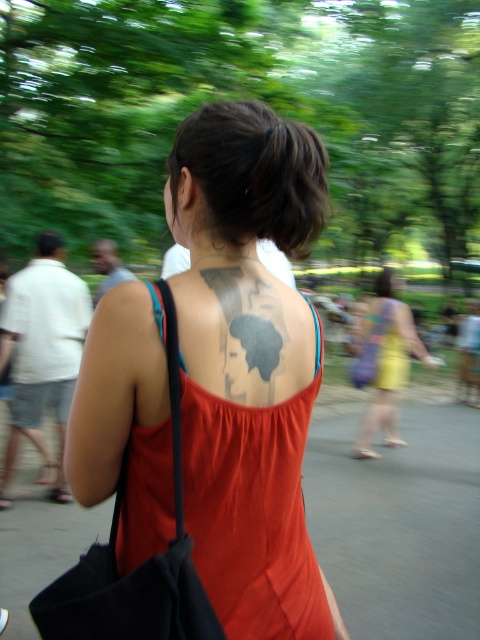
Between point (271, 364) and point (415, 336), which one is positioned in front?

Point (271, 364) is in front.

Which is in front, point (243, 323) or point (372, 336)?

Point (243, 323) is in front.

Image resolution: width=480 pixels, height=640 pixels. What are the coordinates of `black ink tattoo at upper back` in the screenshot? It's located at (249, 330).

How much distance is there between matte black tattoo at upper center and yellow fabric dress at center?

matte black tattoo at upper center and yellow fabric dress at center are 2.93 meters apart from each other.

Consider the image. Does matte black tattoo at upper center have a greater height compared to yellow fabric dress at center?

Yes.

This screenshot has height=640, width=480. I want to click on matte black tattoo at upper center, so click(43, 348).

The height and width of the screenshot is (640, 480). I want to click on matte black tattoo at upper center, so click(43, 348).

Is dark gray tattoo at center back smaller than yellow fabric dress at center?

Correct, dark gray tattoo at center back occupies less space than yellow fabric dress at center.

Who is positioned more to the left, dark gray tattoo at center back or yellow fabric dress at center?

dark gray tattoo at center back

Image resolution: width=480 pixels, height=640 pixels. What do you see at coordinates (249, 364) in the screenshot?
I see `dark gray tattoo at center back` at bounding box center [249, 364].

You are a GUI agent. You are given a task and a screenshot of the screen. Output one action in this format:
    pyautogui.click(x=<x>, y=<y>)
    Task: Click on the dark gray tattoo at center back
    
    Given the screenshot: What is the action you would take?
    pyautogui.click(x=249, y=364)